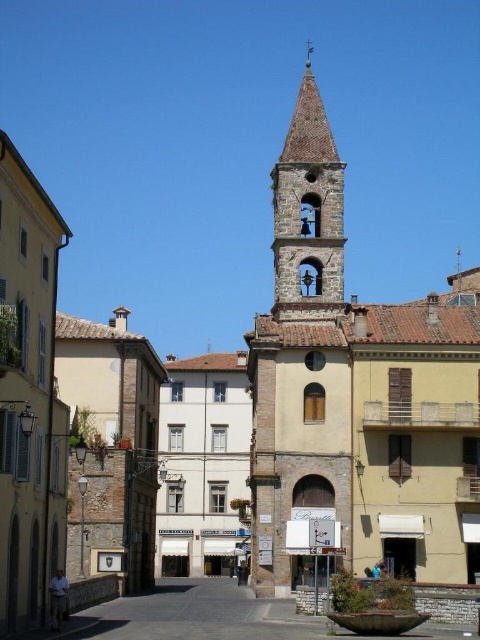
Question: Which point appears closest to the camera in this image?

Choices:
 (A) (409, 522)
 (B) (419, 598)

Answer: (B)

Question: Is smooth concrete alley at center closer to camera compared to stone bell tower at center?

Choices:
 (A) no
 (B) yes

Answer: (B)

Question: Which point is farther to the camera?

Choices:
 (A) stone bell tower at center
 (B) smooth concrete alley at center
 (C) light brown stone church at center

Answer: (A)

Question: Does smooth concrete alley at center have a lesser width compared to stone bell tower at center?

Choices:
 (A) no
 (B) yes

Answer: (A)

Question: Estimate the real-world distances between objects in this image. Which object is farther from the smooth concrete alley at center?

Choices:
 (A) light brown stone church at center
 (B) stone bell tower at center

Answer: (B)

Question: Can you confirm if light brown stone church at center is positioned to the right of smooth concrete alley at center?

Choices:
 (A) yes
 (B) no

Answer: (A)